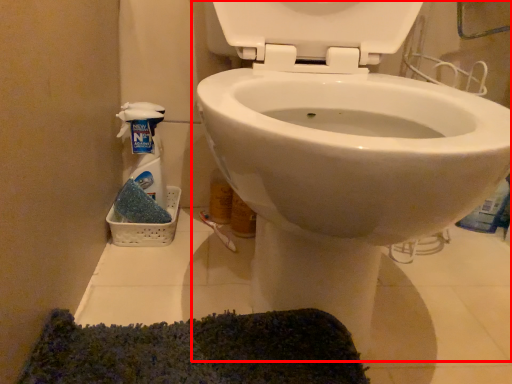
Question: In this image, where is toilet (annotated by the red box) located relative to cleaning product?

Choices:
 (A) left
 (B) right

Answer: (B)